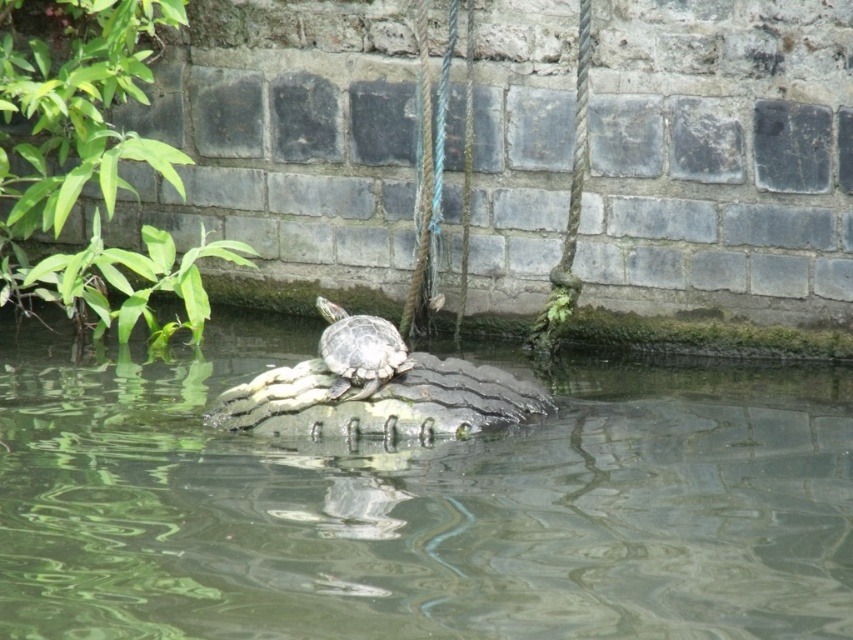
Question: Which point is closer to the camera?

Choices:
 (A) greenish water at center
 (B) smooth green tortoise at center

Answer: (A)

Question: Which point is farther from the camera taking this photo?

Choices:
 (A) (360, 525)
 (B) (332, 333)

Answer: (B)

Question: Does greenish water at center have a larger size compared to smooth green tortoise at center?

Choices:
 (A) no
 (B) yes

Answer: (B)

Question: Is greenish water at center closer to camera compared to smooth green tortoise at center?

Choices:
 (A) yes
 (B) no

Answer: (A)

Question: Which point is farther from the camera taking this photo?

Choices:
 (A) (183, 570)
 (B) (378, 355)

Answer: (B)

Question: Is greenish water at center smaller than smooth green tortoise at center?

Choices:
 (A) yes
 (B) no

Answer: (B)